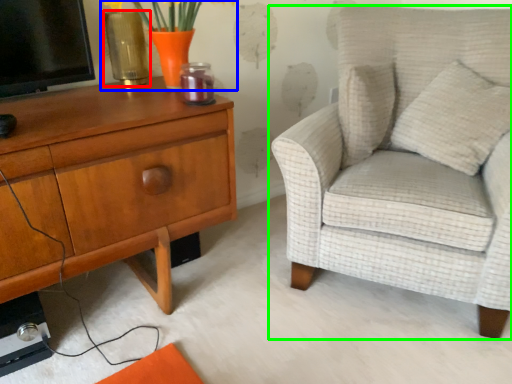
Question: Which object is the closest to the vase (highlighted by a red box)? Choose among these: floral arrangement (highlighted by a blue box) or chair (highlighted by a green box).

Choices:
 (A) floral arrangement
 (B) chair

Answer: (A)